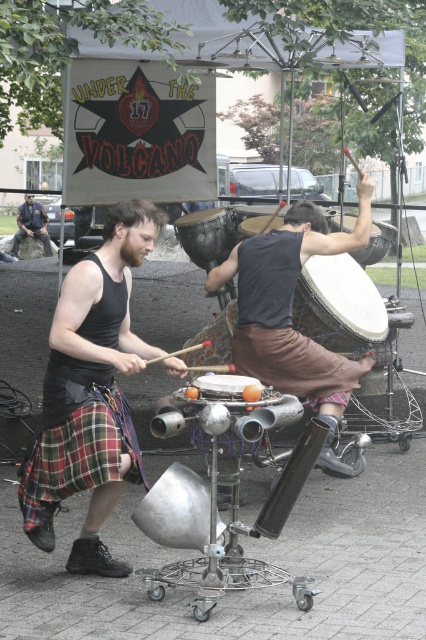
Question: Among these objects, which one is farthest from the camera?

Choices:
 (A) matte silver drum at center
 (B) white matte drum at center
 (C) black drum at center
 (D) matte black drum at center

Answer: (C)

Question: Is brown leather pants at center below black drum at center?

Choices:
 (A) no
 (B) yes

Answer: (B)

Question: Does black fabric tank top at center have a lesser width compared to white matte drum at center?

Choices:
 (A) no
 (B) yes

Answer: (A)

Question: Among these points, which one is farthest from the camera?

Choices:
 (A) (17, 246)
 (B) (213, 394)
 (C) (273, 227)
 (D) (118, 236)

Answer: (A)

Question: Which of the following is the closest to the observer?

Choices:
 (A) click(x=331, y=227)
 (B) click(x=42, y=228)
 (C) click(x=279, y=225)

Answer: (C)

Question: Is brown leather pants at center positioned at the back of black leather jacket at left?

Choices:
 (A) yes
 (B) no

Answer: (B)